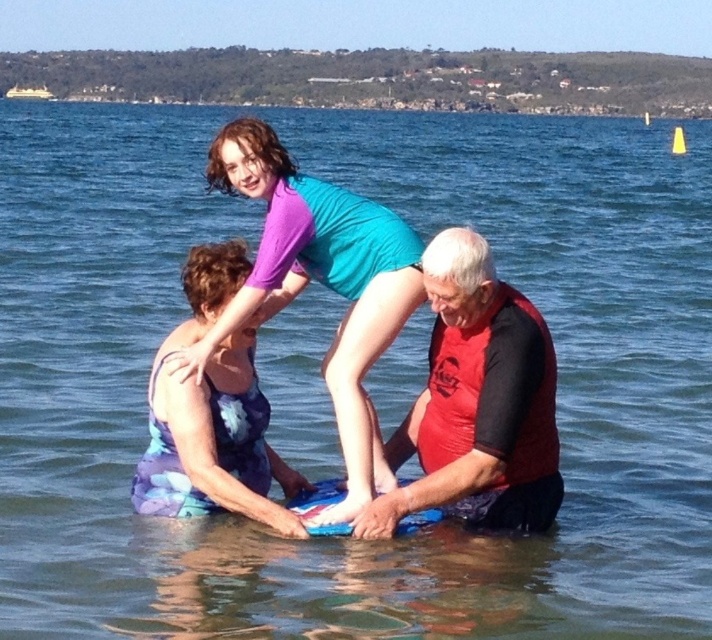
Question: Observing the image, what is the correct spatial positioning of red matte wetsuit at center in reference to purple fabric dress at lower left?

Choices:
 (A) left
 (B) right

Answer: (B)

Question: Which object is the farthest from the red matte wetsuit at center?

Choices:
 (A) matte purple swimsuit at center
 (B) purple fabric dress at lower left

Answer: (A)

Question: Is matte purple swimsuit at center thinner than purple fabric dress at lower left?

Choices:
 (A) yes
 (B) no

Answer: (B)

Question: Is red matte wetsuit at center below matte purple swimsuit at center?

Choices:
 (A) no
 (B) yes

Answer: (B)

Question: Which of the following is the farthest from the observer?

Choices:
 (A) red matte wetsuit at center
 (B) matte purple swimsuit at center
 (C) purple fabric dress at lower left

Answer: (B)

Question: Which of the following is the farthest from the observer?

Choices:
 (A) (357, 477)
 (B) (194, 336)

Answer: (A)